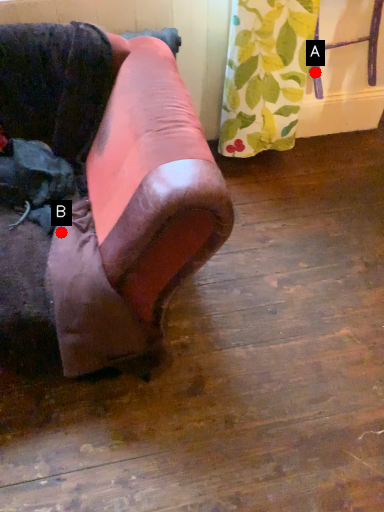
Question: Two points are circled on the image, labeled by A and B beside each circle. Which point is farther to the camera?

Choices:
 (A) A is further
 (B) B is further

Answer: (A)